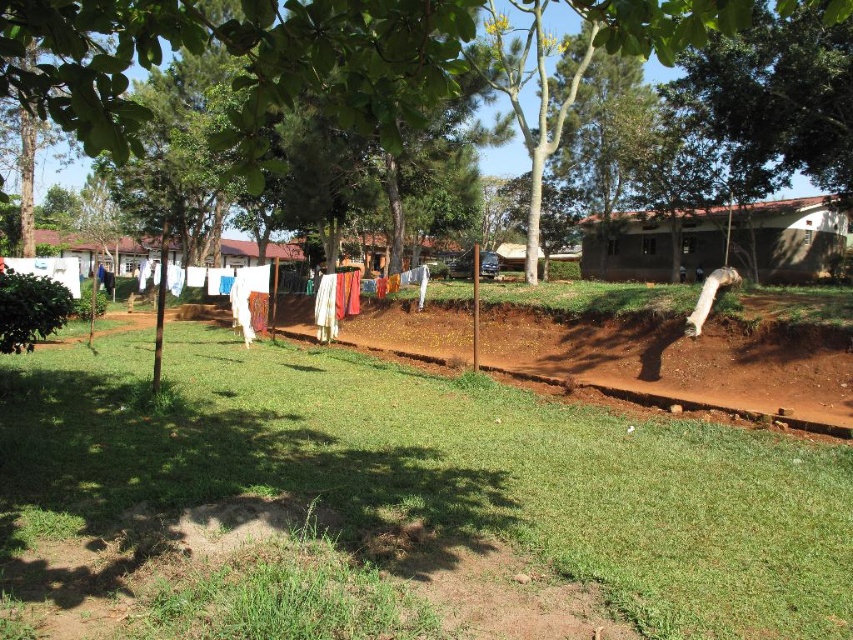
You are standing at the edge of the lawn and see the green grass at center and the green leafy tree at center. If you want to walk towards the tree, which direction should you move relative to the grass?

You should move to the right relative to the green grass at center because the green grass at center is to the left of the green leafy tree at center, meaning the tree is to the right of the grass.